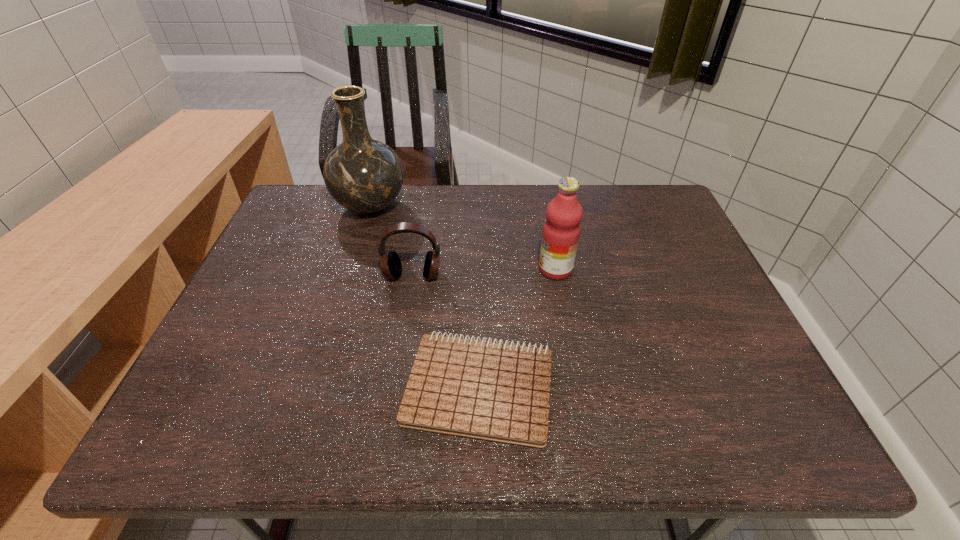
Image resolution: width=960 pixels, height=540 pixels. In order to click on vase in this screenshot , I will do `click(364, 175)`.

You are a GUI agent. You are given a task and a screenshot of the screen. Output one action in this format:
    pyautogui.click(x=<x>, y=<y>)
    Task: Click on the farthest object
    
    Given the screenshot: What is the action you would take?
    pyautogui.click(x=364, y=175)

The image size is (960, 540). Find the location of `fruit juice`. fruit juice is located at coordinates (561, 231).

Where is `the rightmost object`? the rightmost object is located at coordinates (561, 231).

Where is `headset`? headset is located at coordinates (390, 263).

I want to click on the nearest object, so click(492, 391).

Find the location of a particular element. The height and width of the screenshot is (540, 960). notebook is located at coordinates (492, 391).

Where is `free space located 0.190m on the right of the tallest object`? This screenshot has width=960, height=540. free space located 0.190m on the right of the tallest object is located at coordinates (468, 206).

I want to click on free space located on the label of the third shortest object, so click(394, 269).

Where is `vacant region located on the label of the third shortest object`? vacant region located on the label of the third shortest object is located at coordinates (443, 269).